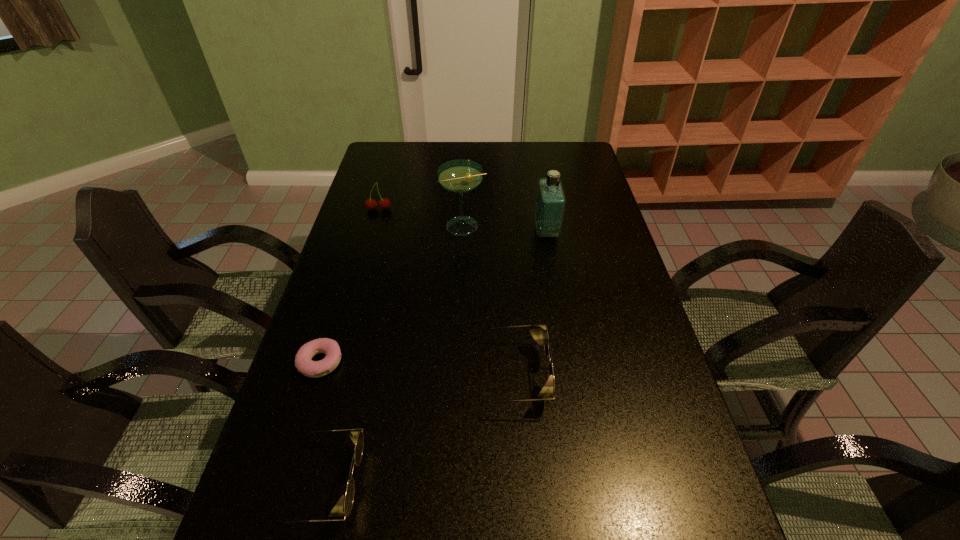
Identify the location of vacant position located on the surface of the farthest object. This screenshot has height=540, width=960. (358, 282).

Where is `vacant space positioned 0.340m on the front label of the rightmost object`? vacant space positioned 0.340m on the front label of the rightmost object is located at coordinates (433, 232).

Find the location of `vacant space located on the front label of the rightmost object`. vacant space located on the front label of the rightmost object is located at coordinates (481, 232).

In order to click on free space located 0.390m on the front label of the rightmost object in this screenshot , I will do `click(418, 232)`.

I want to click on vacant region located on the right of the shortest object, so click(424, 362).

You are a GUI agent. You are given a task and a screenshot of the screen. Output one action in this format:
    pyautogui.click(x=<x>, y=<y>)
    Task: Click on the free space located 0.270m on the back of the martini
    
    Given the screenshot: What is the action you would take?
    pyautogui.click(x=466, y=173)

The height and width of the screenshot is (540, 960). I want to click on object present at the near edge, so click(356, 436).

I want to click on sunglasses positioned at the left edge, so click(356, 436).

Where is `cherry located in the left edge section of the desktop`? The width and height of the screenshot is (960, 540). cherry located in the left edge section of the desktop is located at coordinates tap(384, 203).

This screenshot has height=540, width=960. Identify the location of doughnut that is at the left edge. (303, 363).